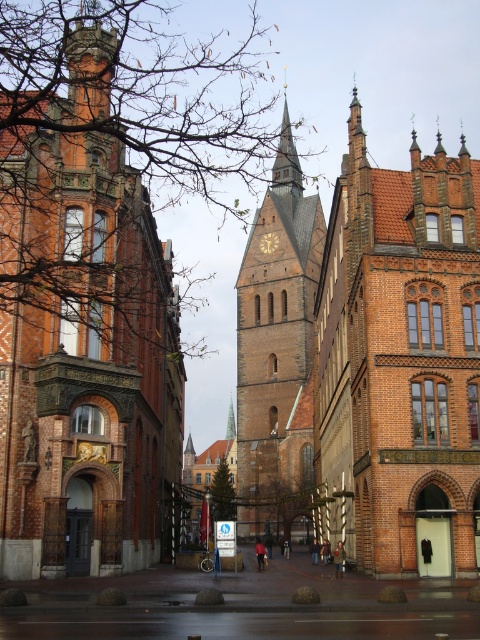
Is red brick church at left closer to the viewer compared to brown brick tower at center?

That is True.

Is red brick church at left below brown brick tower at center?

No, red brick church at left is not below brown brick tower at center.

The width and height of the screenshot is (480, 640). Identify the location of red brick church at left. coord(82,323).

Find the location of `red brick church at left`. red brick church at left is located at coordinates (82, 323).

This screenshot has height=640, width=480. What do you see at coordinates (400, 362) in the screenshot? I see `brown brick church at center` at bounding box center [400, 362].

Does brown brick church at center come behind gold textured clock at center?

No, it is not.

What do you see at coordinates (400, 362) in the screenshot?
I see `brown brick church at center` at bounding box center [400, 362].

Identify the location of brown brick church at center. This screenshot has height=640, width=480. (400, 362).

Does point (266, 237) come behind point (227, 435)?

No, (266, 237) is in front of (227, 435).

Does gold textured clock at center have a lesser height compared to green copper spire at center?

Yes, gold textured clock at center is shorter than green copper spire at center.

Looking at this image, measure the distance between point (267,253) and camera.

The distance of point (267,253) from camera is 166.18 meters.

Locate an element on the screen. The width and height of the screenshot is (480, 640). gold textured clock at center is located at coordinates (268, 243).